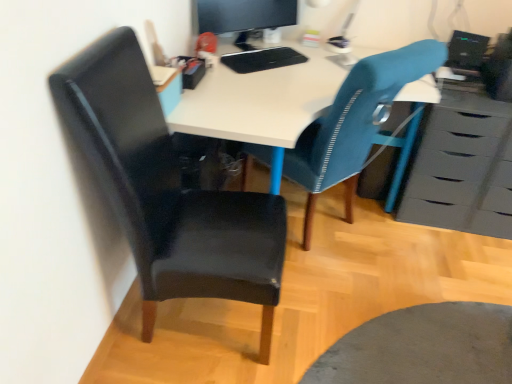
The width and height of the screenshot is (512, 384). What are the coordinates of `black glossy computer at upper right` in the screenshot? It's located at (463, 62).

Locate an element on the screen. Image resolution: width=512 pixels, height=384 pixels. textured blue chair at center, arranged as the 1th chair when viewed from the right is located at coordinates (355, 123).

The image size is (512, 384). What are the coordinates of `black leather chair at left, acting as the 1th chair starting from the left` in the screenshot? It's located at (167, 190).

From the matte gray chest of drawers at right, count the 1st chair to the left and point to it. Please provide its 2D coordinates.

[(355, 123)]

From the image's perspective, between textured blue chair at center, arranged as the 1th chair when viewed from the right, and matte gray chest of drawers at right, which one is located above?

From the image's view, matte gray chest of drawers at right is above.

Which object is more forward, textured blue chair at center, arranged as the 1th chair when viewed from the right, or matte gray chest of drawers at right?

textured blue chair at center, arranged as the 1th chair when viewed from the right.

Based on the photo, is textured blue chair at center, arranged as the 1th chair when viewed from the right, wider or thinner than matte gray chest of drawers at right?

Considering their sizes, textured blue chair at center, arranged as the 1th chair when viewed from the right, looks broader than matte gray chest of drawers at right.

From the image's perspective, who appears lower, black glossy computer at upper right or matte black monitor at upper center?

black glossy computer at upper right, from the image's perspective.

Can you tell me how much black glossy computer at upper right and matte black monitor at upper center differ in facing direction?

They differ by 62.7 degrees in their facing directions.

In the scene shown: Is black glossy computer at upper right at the right side of matte black monitor at upper center?

Indeed, black glossy computer at upper right is positioned on the right side of matte black monitor at upper center.

Which object is closer to the camera taking this photo, matte gray chest of drawers at right or black leather chair at left, acting as the 1th chair starting from the left?

black leather chair at left, acting as the 1th chair starting from the left.

At what (x,y) coordinates should I click in order to perform the action: click on the 2nd chair to the left of the matte gray chest of drawers at right, starting your count from the anchor. Please return your answer as a coordinate pair (x, y). The height and width of the screenshot is (384, 512). Looking at the image, I should click on (167, 190).

From the image's perspective, does matte gray chest of drawers at right appear higher than black leather chair at left, the second chair in the right-to-left sequence?

Correct, matte gray chest of drawers at right appears higher than black leather chair at left, the second chair in the right-to-left sequence, in the image.

Is textured blue chair at center, the 2th chair positioned from the left, not close to black leather chair at left, acting as the 1th chair starting from the left?

No, textured blue chair at center, the 2th chair positioned from the left, is not far from black leather chair at left, acting as the 1th chair starting from the left.

Between textured blue chair at center, the 2th chair positioned from the left, and black leather chair at left, the second chair in the right-to-left sequence, which one has smaller width?

black leather chair at left, the second chair in the right-to-left sequence.

Considering the sizes of objects textured blue chair at center, arranged as the 1th chair when viewed from the right, and black leather chair at left, the second chair in the right-to-left sequence, in the image provided, who is smaller, textured blue chair at center, arranged as the 1th chair when viewed from the right, or black leather chair at left, the second chair in the right-to-left sequence,?

textured blue chair at center, arranged as the 1th chair when viewed from the right, is smaller.

Is textured blue chair at center, the 2th chair positioned from the left, surrounding black leather chair at left, acting as the 1th chair starting from the left?

Definitely not — black leather chair at left, acting as the 1th chair starting from the left, is not inside textured blue chair at center, the 2th chair positioned from the left.

Is matte gray chest of drawers at right to the right of textured blue chair at center, arranged as the 1th chair when viewed from the right, from the viewer's perspective?

Yes.

Is matte gray chest of drawers at right oriented away from textured blue chair at center, arranged as the 1th chair when viewed from the right?

No, matte gray chest of drawers at right is not facing the opposite direction of textured blue chair at center, arranged as the 1th chair when viewed from the right.

How different are the orientations of matte gray chest of drawers at right and textured blue chair at center, arranged as the 1th chair when viewed from the right, in degrees?

132 degrees separate the facing orientations of matte gray chest of drawers at right and textured blue chair at center, arranged as the 1th chair when viewed from the right.

Looking at this image, is matte gray chest of drawers at right bigger than textured blue chair at center, arranged as the 1th chair when viewed from the right?

No.

Is point (456, 43) closer to viewer compared to point (108, 184)?

That is False.

Can you confirm if black glossy computer at upper right is wider than black leather chair at left, acting as the 1th chair starting from the left?

No.

Is black glossy computer at upper right positioned with its back to black leather chair at left, acting as the 1th chair starting from the left?

No, black glossy computer at upper right is not facing the opposite direction of black leather chair at left, acting as the 1th chair starting from the left.

Can you confirm if black glossy computer at upper right is positioned to the right of black leather chair at left, the second chair in the right-to-left sequence?

Yes.

Consider the image. From a real-world perspective, is matte gray chest of drawers at right positioned under matte black monitor at upper center based on gravity?

Correct, in the physical world, matte gray chest of drawers at right is lower than matte black monitor at upper center.

Is matte gray chest of drawers at right turned away from matte black monitor at upper center?

No, matte gray chest of drawers at right is not facing the opposite direction of matte black monitor at upper center.

From the picture: Is matte gray chest of drawers at right located outside matte black monitor at upper center?

Yes, matte gray chest of drawers at right is located beyond the bounds of matte black monitor at upper center.

Are matte gray chest of drawers at right and matte black monitor at upper center beside each other?

matte gray chest of drawers at right is not next to matte black monitor at upper center, and they're not touching.

At what (x,y) coordinates should I click in order to perform the action: click on the chest of drawers lying above the textured blue chair at center, the 2th chair positioned from the left (from the image's perspective). Please return your answer as a coordinate pair (x, y). This screenshot has height=384, width=512. Looking at the image, I should click on (463, 168).

Image resolution: width=512 pixels, height=384 pixels. What are the coordinates of `computer on the right of matte black monitor at upper center` in the screenshot? It's located at (463, 62).

Estimate the real-world distances between objects in this image. Which object is further from textured blue chair at center, the 2th chair positioned from the left, matte gray chest of drawers at right or black leather chair at left, the second chair in the right-to-left sequence?

The object further to textured blue chair at center, the 2th chair positioned from the left, is black leather chair at left, the second chair in the right-to-left sequence.

Based on their spatial positions, is black leather chair at left, acting as the 1th chair starting from the left, or matte black monitor at upper center closer to matte gray chest of drawers at right?

Based on the image, black leather chair at left, acting as the 1th chair starting from the left, appears to be nearer to matte gray chest of drawers at right.

When comparing their distances from matte black monitor at upper center, does black glossy computer at upper right or matte gray chest of drawers at right seem closer?

Based on the image, black glossy computer at upper right appears to be nearer to matte black monitor at upper center.

Looking at the image, which one is located closer to black leather chair at left, the second chair in the right-to-left sequence, matte gray chest of drawers at right or matte black monitor at upper center?

matte black monitor at upper center is positioned closer to the anchor black leather chair at left, the second chair in the right-to-left sequence.

When comparing their distances from matte black monitor at upper center, does black leather chair at left, the second chair in the right-to-left sequence, or textured blue chair at center, arranged as the 1th chair when viewed from the right, seem further?

The object further to matte black monitor at upper center is black leather chair at left, the second chair in the right-to-left sequence.

When comparing their distances from matte gray chest of drawers at right, does textured blue chair at center, the 2th chair positioned from the left, or black glossy computer at upper right seem further?

Based on the image, textured blue chair at center, the 2th chair positioned from the left, appears to be further to matte gray chest of drawers at right.

Considering their positions, is black glossy computer at upper right positioned further to black leather chair at left, the second chair in the right-to-left sequence, than matte gray chest of drawers at right?

black glossy computer at upper right.

Considering their positions, is black glossy computer at upper right positioned closer to matte black monitor at upper center than black leather chair at left, acting as the 1th chair starting from the left?

black glossy computer at upper right is positioned closer to the anchor matte black monitor at upper center.

The width and height of the screenshot is (512, 384). Find the location of `chair between black leather chair at left, the second chair in the right-to-left sequence, and black glossy computer at upper right, in the horizontal direction`. chair between black leather chair at left, the second chair in the right-to-left sequence, and black glossy computer at upper right, in the horizontal direction is located at coordinates (355, 123).

This screenshot has width=512, height=384. Identify the location of chest of drawers between black leather chair at left, acting as the 1th chair starting from the left, and black glossy computer at upper right, in the horizontal direction. (463, 168).

Locate an element on the screen. chair between matte black monitor at upper center and matte gray chest of drawers at right is located at coordinates coord(355,123).

Find the location of `computer monitor between black leather chair at left, acting as the 1th chair starting from the left, and matte gray chest of drawers at right, in the horizontal direction`. computer monitor between black leather chair at left, acting as the 1th chair starting from the left, and matte gray chest of drawers at right, in the horizontal direction is located at coordinates (244, 17).